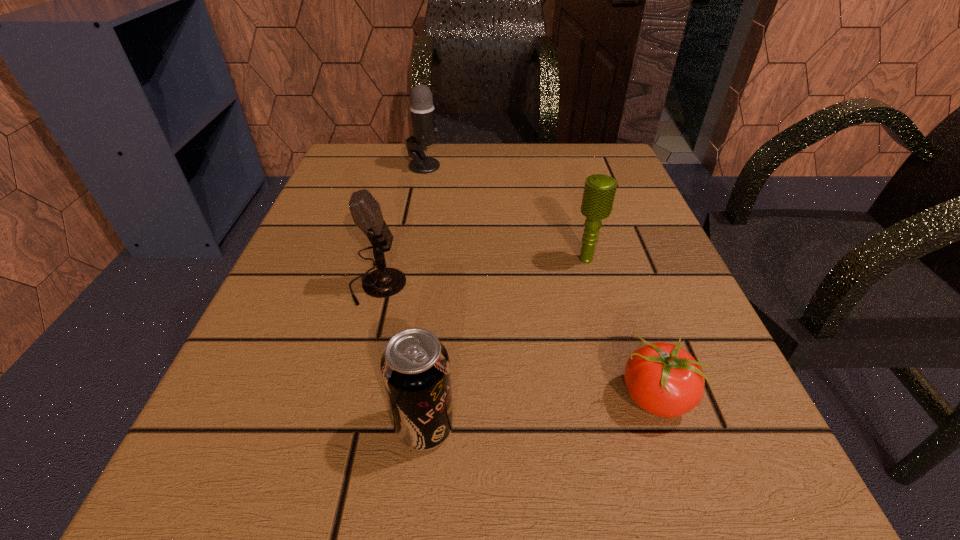
Find the location of a particular element. The width and height of the screenshot is (960, 540). blank space at the far left corner is located at coordinates (324, 187).

At what (x,y) coordinates should I click in order to perform the action: click on unoccupied area between the soda can and the rightmost microphone. Please return your answer as a coordinate pair (x, y). The image size is (960, 540). Looking at the image, I should click on (506, 343).

This screenshot has height=540, width=960. Identify the location of empty space that is in between the soda can and the shortest object. (540, 413).

This screenshot has height=540, width=960. I want to click on free space between the farthest microphone and the nearest microphone, so 400,226.

Image resolution: width=960 pixels, height=540 pixels. In order to click on unoccupied position between the rightmost microphone and the farthest object in this screenshot , I will do [506, 213].

At what (x,y) coordinates should I click in order to perform the action: click on vacant area that lies between the shortest object and the third nearest object. Please return your answer as a coordinate pair (x, y). The image size is (960, 540). Looking at the image, I should click on point(516,342).

Where is `free point between the farthest microphone and the nearest microphone`? free point between the farthest microphone and the nearest microphone is located at coordinates (400, 226).

Identify the location of free point between the rightmost microphone and the tomato. This screenshot has width=960, height=540. (620, 329).

At what (x,y) coordinates should I click in order to perform the action: click on free space between the soda can and the tomato. Please return your answer as a coordinate pair (x, y). This screenshot has width=960, height=540. Looking at the image, I should click on (540, 413).

Select which object is the second closest to the soda can. Please provide its 2D coordinates. Your answer should be formatted as a tuple, i.e. [(x, y)], where the tuple contains the x and y coordinates of a point satisfying the conditions above.

[(663, 379)]